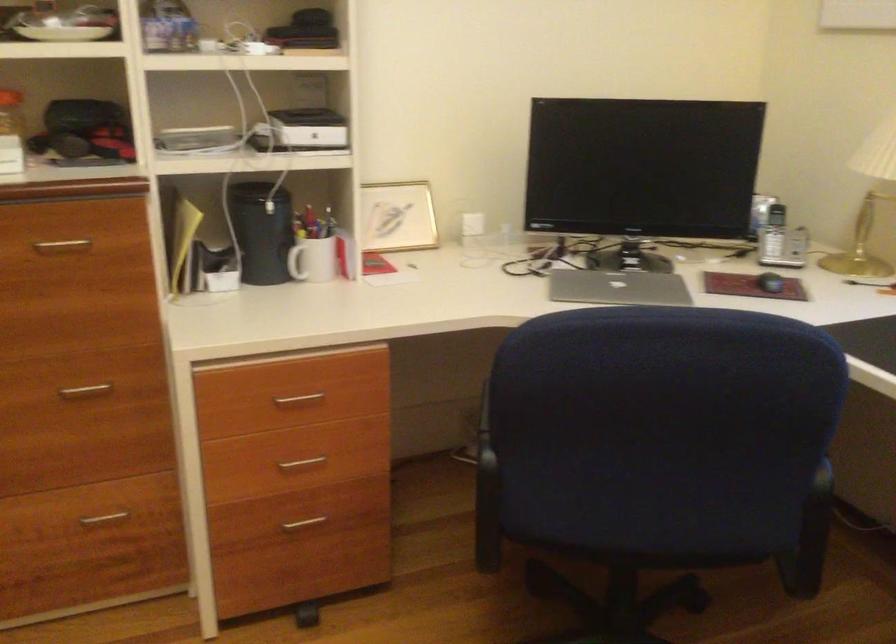
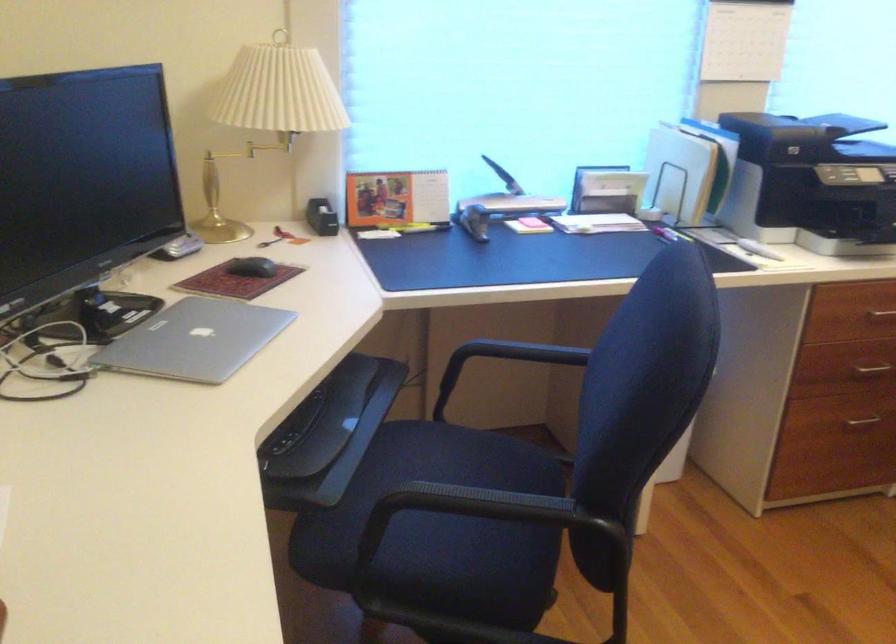
Where in the second image is the point corresponding to point 502,412 from the first image?

(458, 511)